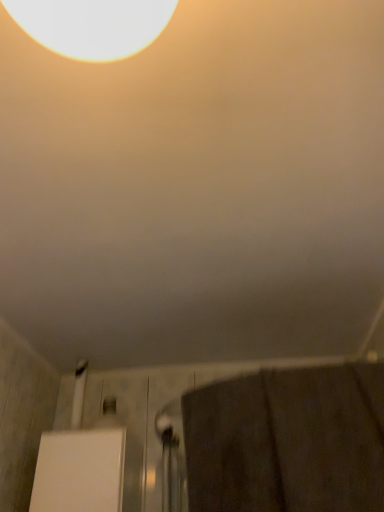
Question: In the image, is brown textured towel at lower right on the left side or the right side of white glossy lampshade at upper left?

Choices:
 (A) left
 (B) right

Answer: (B)

Question: Considering the positions of brown textured towel at lower right and white glossy lampshade at upper left in the image, is brown textured towel at lower right bigger or smaller than white glossy lampshade at upper left?

Choices:
 (A) small
 (B) big

Answer: (B)

Question: Choose the correct answer: Is brown textured towel at lower right inside white glossy lampshade at upper left or outside it?

Choices:
 (A) outside
 (B) inside

Answer: (A)

Question: In the image, is white glossy lampshade at upper left positioned in front of or behind brown textured towel at lower right?

Choices:
 (A) front
 (B) behind

Answer: (A)

Question: From a real-world perspective, is white glossy lampshade at upper left physically located above or below brown textured towel at lower right?

Choices:
 (A) above
 (B) below

Answer: (A)

Question: In terms of size, does white glossy lampshade at upper left appear bigger or smaller than brown textured towel at lower right?

Choices:
 (A) big
 (B) small

Answer: (B)

Question: Is white glossy lampshade at upper left taller or shorter than brown textured towel at lower right?

Choices:
 (A) tall
 (B) short

Answer: (B)